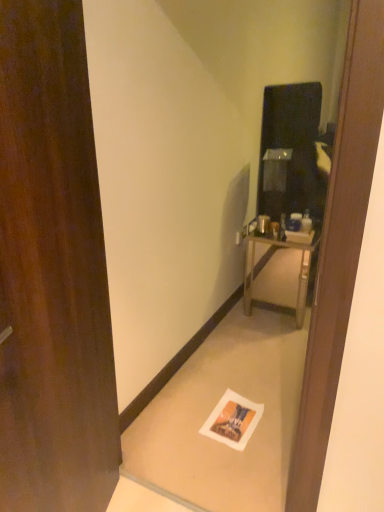
Question: Can you confirm if white paper at lower center is shorter than brown wood door at left?

Choices:
 (A) yes
 (B) no

Answer: (A)

Question: Is white paper at lower center far away from brown wood door at left?

Choices:
 (A) yes
 (B) no

Answer: (B)

Question: Does white paper at lower center come in front of brown wood door at left?

Choices:
 (A) no
 (B) yes

Answer: (A)

Question: From the image's perspective, is white paper at lower center located above brown wood door at left?

Choices:
 (A) no
 (B) yes

Answer: (A)

Question: Is white paper at lower center aimed at brown wood door at left?

Choices:
 (A) yes
 (B) no

Answer: (B)

Question: From their relative heights in the image, would you say white paper at lower center is taller or shorter than brown wood door at left?

Choices:
 (A) tall
 (B) short

Answer: (B)

Question: Is point (251, 419) closer or farther from the camera than point (91, 140)?

Choices:
 (A) closer
 (B) farther

Answer: (B)

Question: Do you think white paper at lower center is within brown wood door at left, or outside of it?

Choices:
 (A) inside
 (B) outside

Answer: (B)

Question: In the image, is white paper at lower center positioned in front of or behind brown wood door at left?

Choices:
 (A) front
 (B) behind

Answer: (B)

Question: Does point click(x=311, y=238) appear closer or farther from the camera than point click(x=13, y=116)?

Choices:
 (A) farther
 (B) closer

Answer: (A)

Question: Considering the positions of metallic silver nightstand at right and brown wood door at left in the image, is metallic silver nightstand at right wider or thinner than brown wood door at left?

Choices:
 (A) wide
 (B) thin

Answer: (A)

Question: From a real-world perspective, relative to brown wood door at left, is metallic silver nightstand at right vertically above or below?

Choices:
 (A) below
 (B) above

Answer: (A)

Question: Relative to brown wood door at left, is metallic silver nightstand at right in front or behind?

Choices:
 (A) behind
 (B) front

Answer: (A)

Question: Is brown wood door at left bigger or smaller than metallic silver nightstand at right?

Choices:
 (A) small
 (B) big

Answer: (B)

Question: Visually, is brown wood door at left positioned to the left or to the right of metallic silver nightstand at right?

Choices:
 (A) right
 (B) left

Answer: (B)